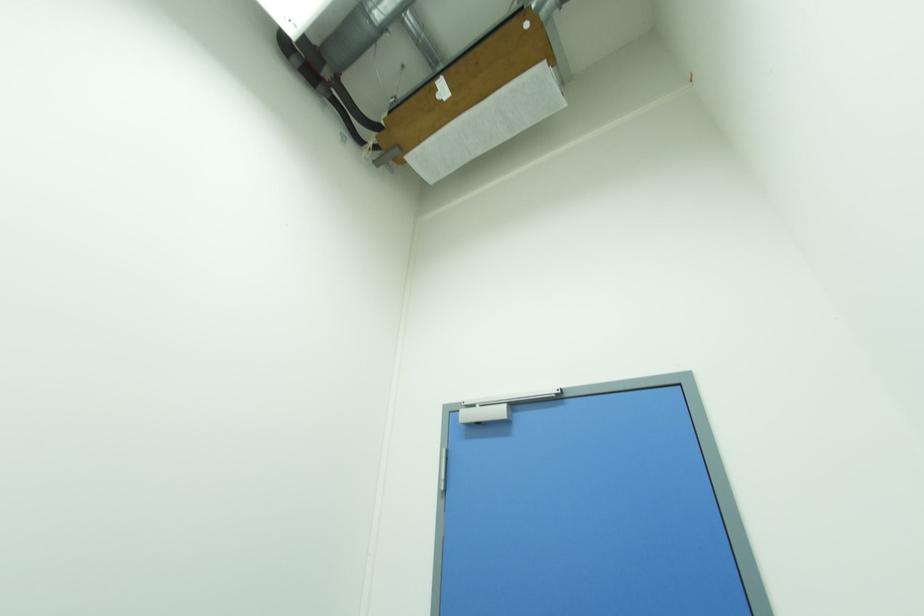
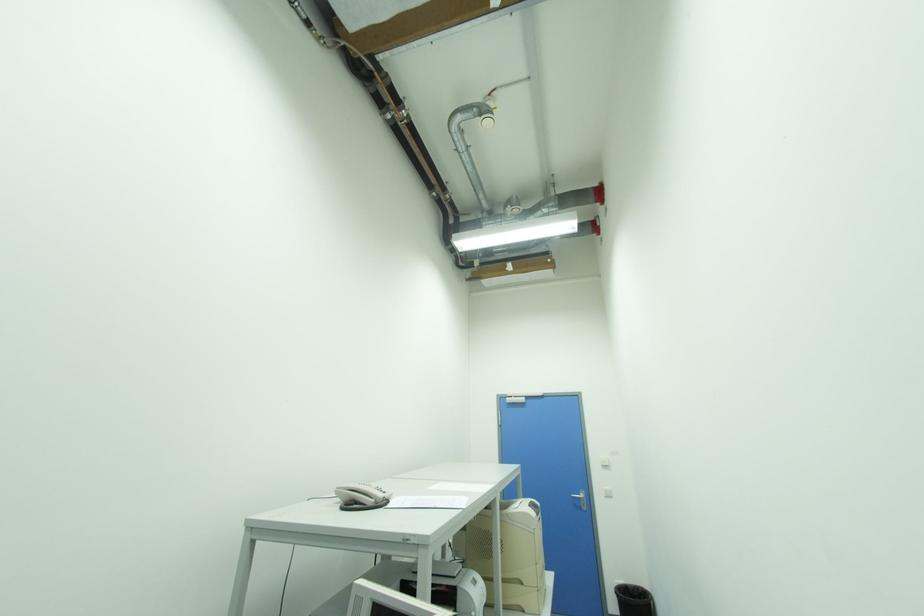
What movement of the cameraman would produce the second image?

The cameraman walked toward left, backward.